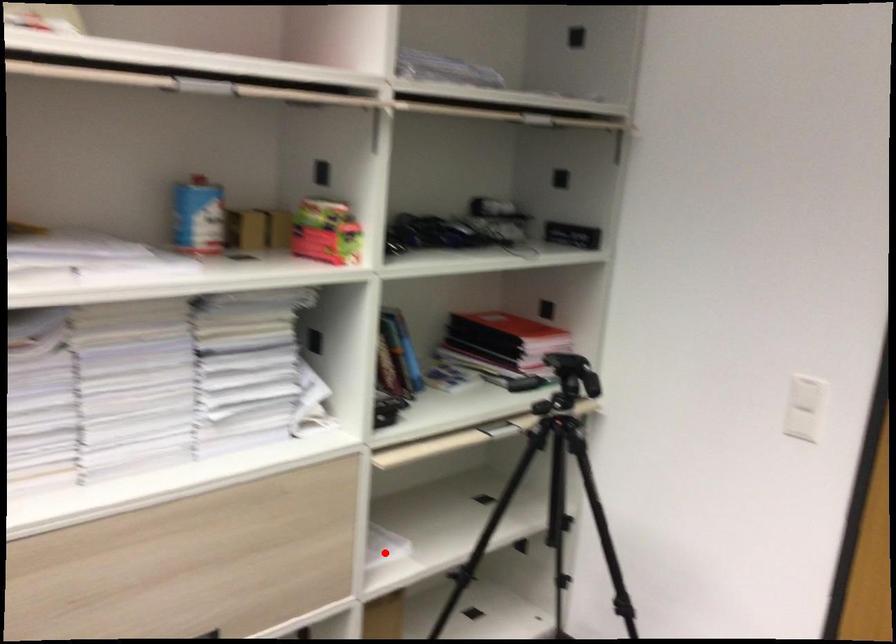
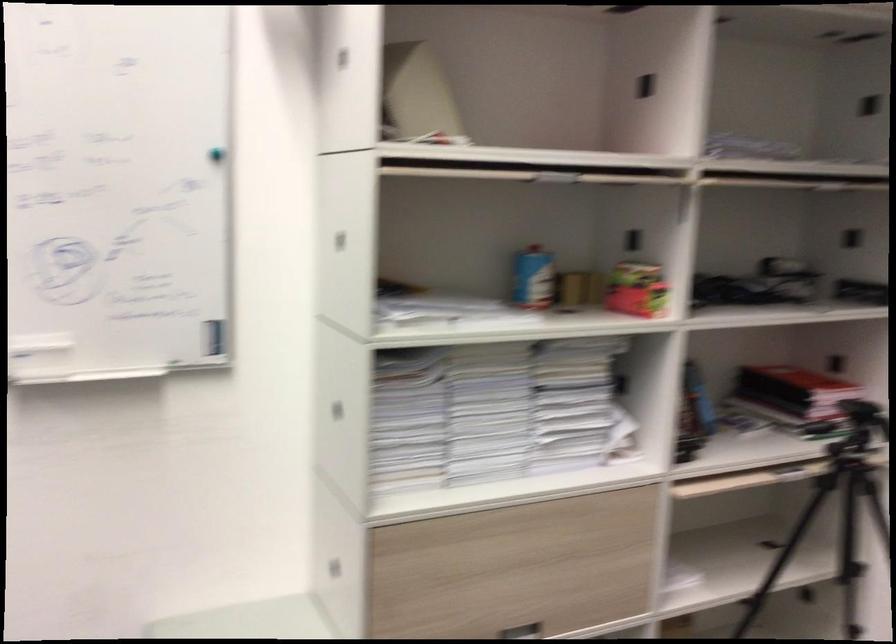
Question: I am providing you with two images of the same scene from different viewpoints. A red point is marked on the first image. Can you still see the location of the red point in image 2?

Choices:
 (A) Yes
 (B) No

Answer: (A)